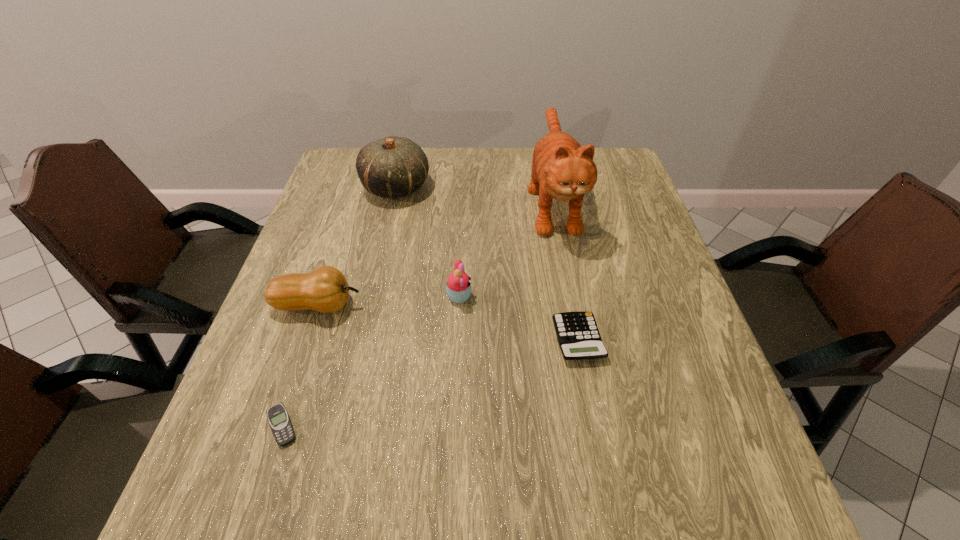
Locate an element on the screen. vacant region that satisfies the following two spatial constraints: 1. on the face of the fifth tallest object; 2. on the left side of the third object from right to left is located at coordinates (457, 339).

Where is `free spot that satisfies the following two spatial constraints: 1. on the back side of the shortest object; 2. on the left side of the taller gourd`? This screenshot has width=960, height=540. free spot that satisfies the following two spatial constraints: 1. on the back side of the shortest object; 2. on the left side of the taller gourd is located at coordinates (360, 187).

Locate an element on the screen. vacant space that satisfies the following two spatial constraints: 1. on the front side of the farther gourd; 2. on the stem side of the nearer gourd is located at coordinates (x=370, y=305).

The height and width of the screenshot is (540, 960). I want to click on vacant area that satisfies the following two spatial constraints: 1. on the face of the tallest object; 2. on the stem side of the shorter gourd, so click(x=573, y=305).